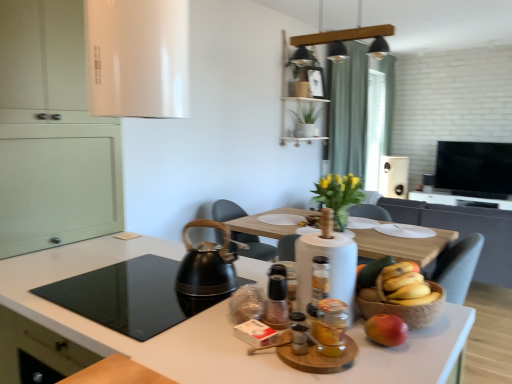
You are a GUI agent. You are given a task and a screenshot of the screen. Output one action in this format:
    pyautogui.click(x=<x>, y=<y>)
    Task: Click on the free point in front of black matte tea kettle at center
    The width and height of the screenshot is (512, 384).
    Given the screenshot: What is the action you would take?
    pyautogui.click(x=172, y=313)